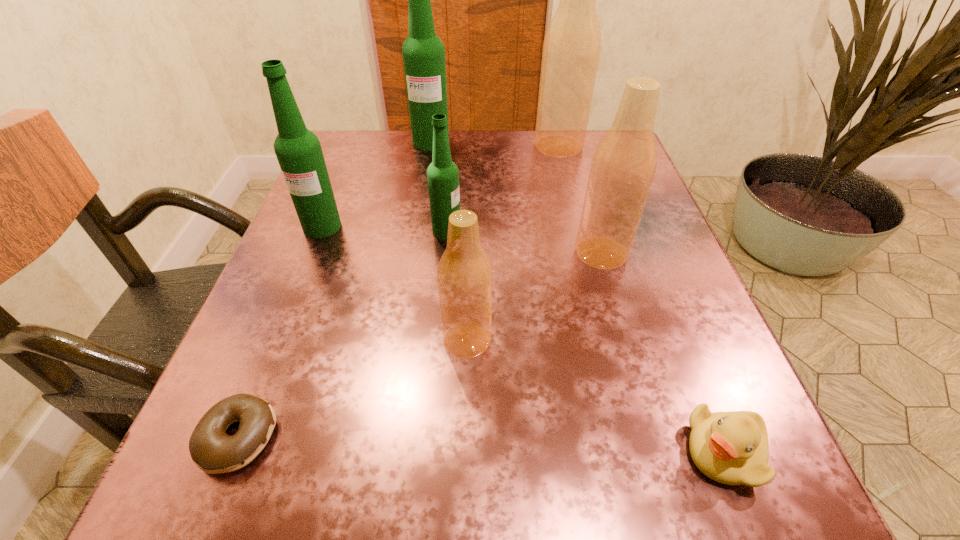
Locate an element on the screen. free space located 0.150m on the beak of the duckling is located at coordinates (563, 452).

Locate an element on the screen. vacant space located 0.180m on the right of the brown doughnut is located at coordinates (421, 437).

Identify the location of duckling that is at the near edge. (731, 448).

Identify the location of doughnut at the near edge. Image resolution: width=960 pixels, height=540 pixels. (214, 451).

You are a GUI agent. You are given a task and a screenshot of the screen. Output one action in this format:
    pyautogui.click(x=<x>, y=<y>)
    Task: Click on the beer bottle located in the left edge section of the desktop
    
    Given the screenshot: What is the action you would take?
    pos(298,150)

Where is `doughnut that is at the left edge`? This screenshot has height=540, width=960. doughnut that is at the left edge is located at coordinates (214, 451).

In order to click on duckling situated at the right edge in this screenshot , I will do `click(731, 448)`.

Where is `object located at the near left corner`? object located at the near left corner is located at coordinates (214, 451).

Where is `object present at the far right corner`? object present at the far right corner is located at coordinates (572, 44).

This screenshot has height=540, width=960. I want to click on object present at the near right corner, so tap(731, 448).